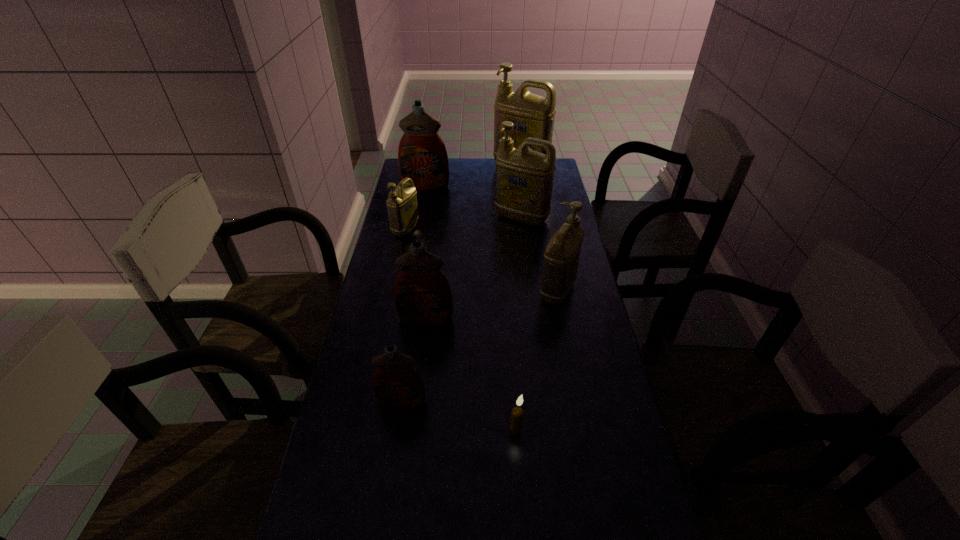
This screenshot has height=540, width=960. Find the location of `the farthest detergent`. the farthest detergent is located at coordinates (533, 116).

Where is `the biggest beige detergent`? This screenshot has width=960, height=540. the biggest beige detergent is located at coordinates (533, 116).

Image resolution: width=960 pixels, height=540 pixels. I want to click on the second biggest beige detergent, so click(x=524, y=178).

Identify the location of the farthest red detergent. The height and width of the screenshot is (540, 960). (422, 156).

Find the location of a particular element. This screenshot has width=960, height=540. the second farthest object is located at coordinates (422, 156).

Where is `the second smallest beige detergent`? The image size is (960, 540). the second smallest beige detergent is located at coordinates (561, 257).

Identify the location of the second nearest red detergent. The image size is (960, 540). (422, 294).

Locate an element on the screen. The height and width of the screenshot is (540, 960). the leftmost beige detergent is located at coordinates (402, 205).

This screenshot has height=540, width=960. What are the coordinates of `the nearest detergent` in the screenshot? It's located at (397, 385).

Locate an element on the screen. This screenshot has width=960, height=540. the smallest red detergent is located at coordinates (397, 385).